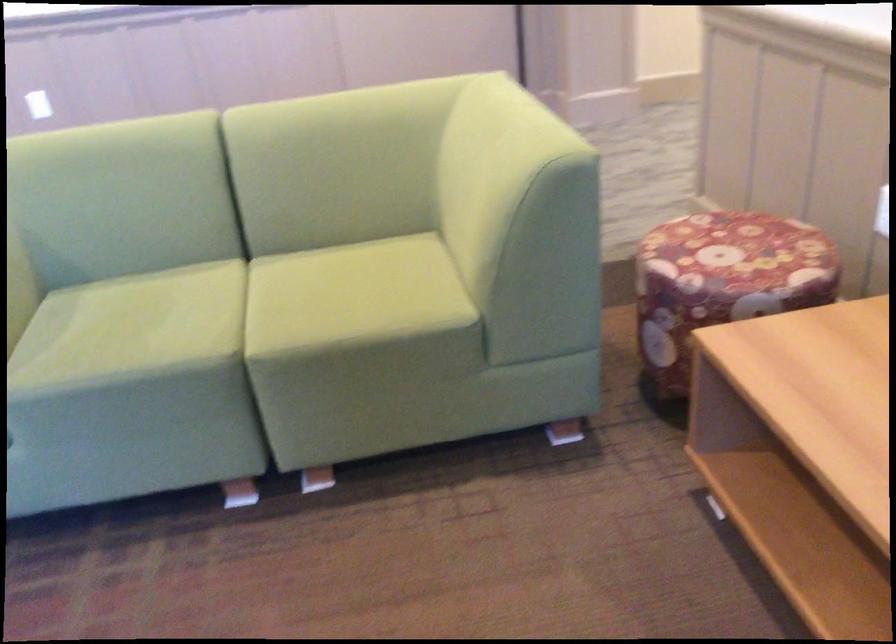
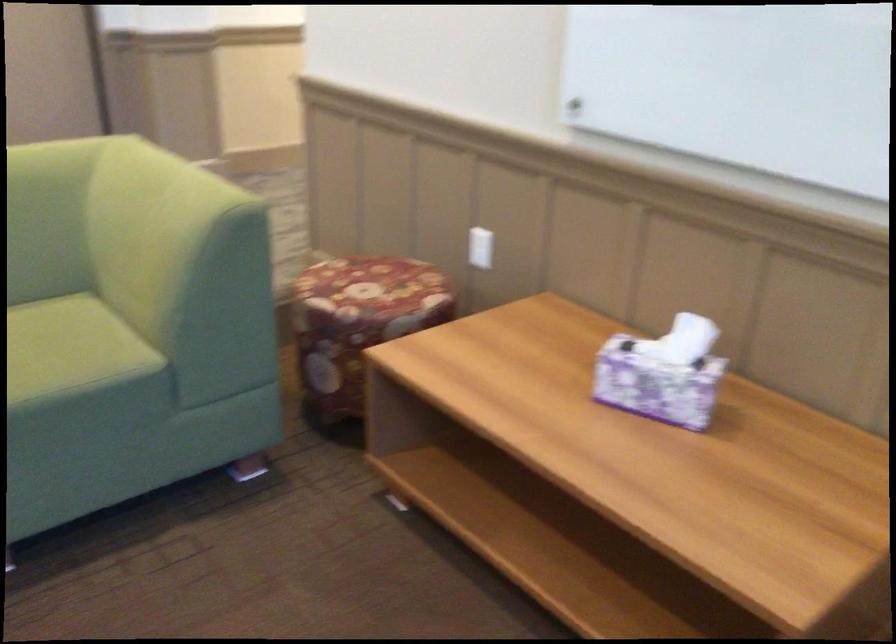
Find the pixel in the second image that matches (x=519, y=122) in the first image.

(181, 184)